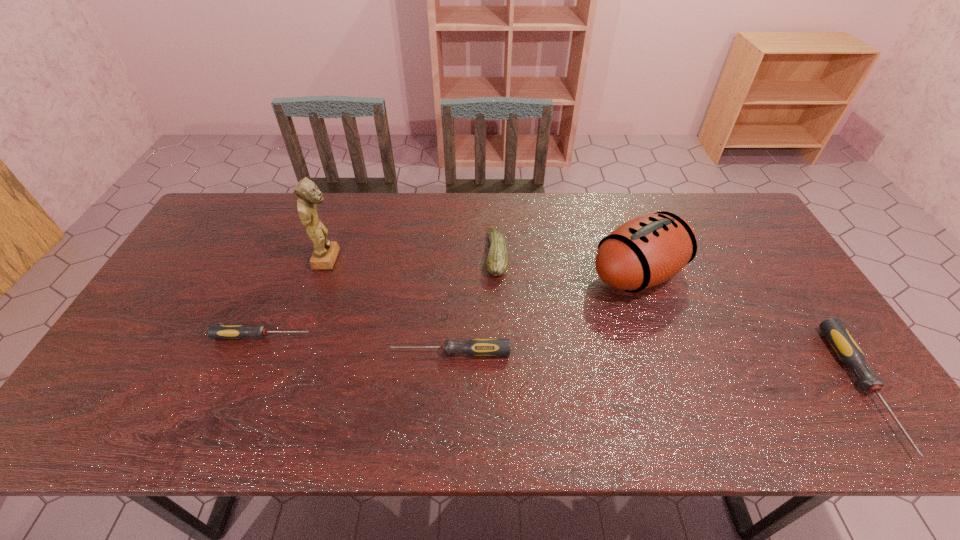
Locate an element on the screen. The height and width of the screenshot is (540, 960). screwdriver that is the closest to the rightmost screwdriver is located at coordinates (479, 347).

Locate an element on the screen. Image resolution: width=960 pixels, height=540 pixels. vacant point that satisfies the following two spatial constraints: 1. on the front-facing side of the tallest object; 2. on the back side of the fifth shortest object is located at coordinates (323, 274).